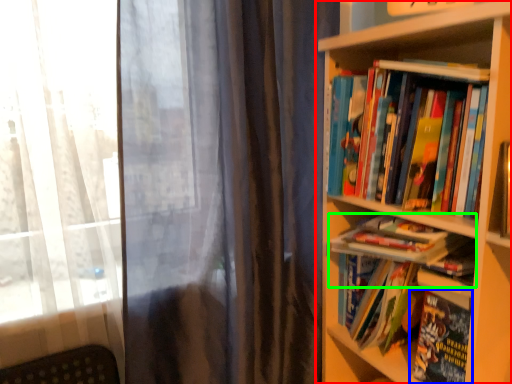
Question: Considering the real-world distances, which object is closest to bookcase (highlighted by a red box)? book (highlighted by a blue box) or book (highlighted by a green box).

Choices:
 (A) book
 (B) book

Answer: (B)